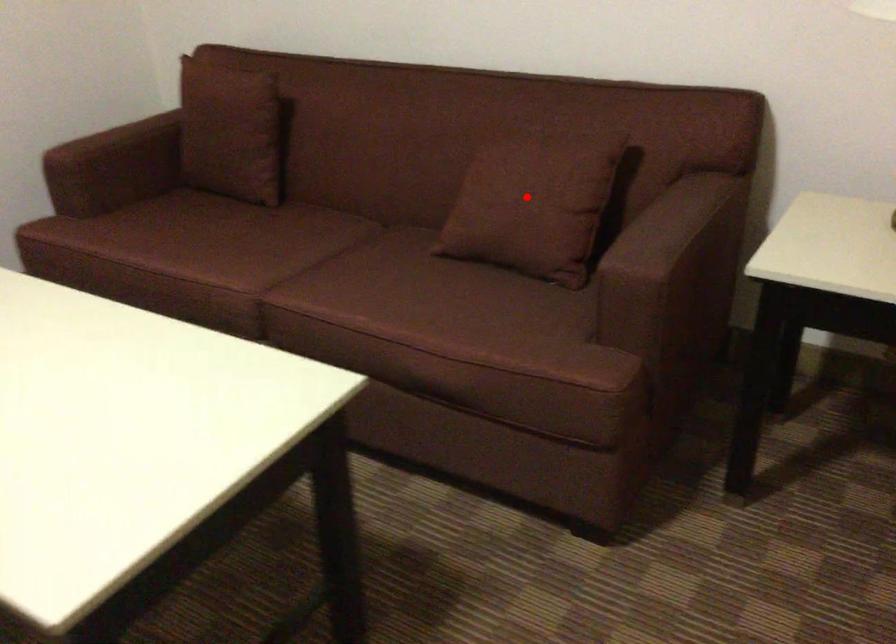
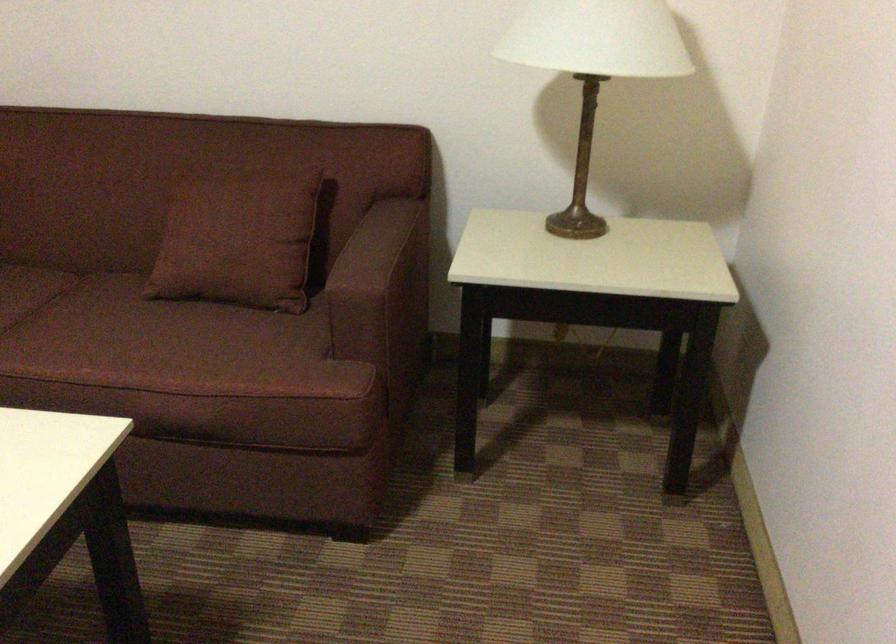
Where in the second image is the point corresponding to the highlighted location from the first image?

(238, 234)